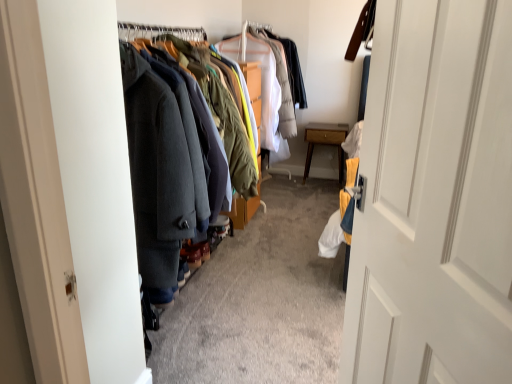
This screenshot has width=512, height=384. What do you see at coordinates (325, 143) in the screenshot?
I see `wooden nightstand at center` at bounding box center [325, 143].

Find the location of `wooden nightstand at center`. wooden nightstand at center is located at coordinates (325, 143).

This screenshot has width=512, height=384. I want to click on wooden nightstand at center, so click(325, 143).